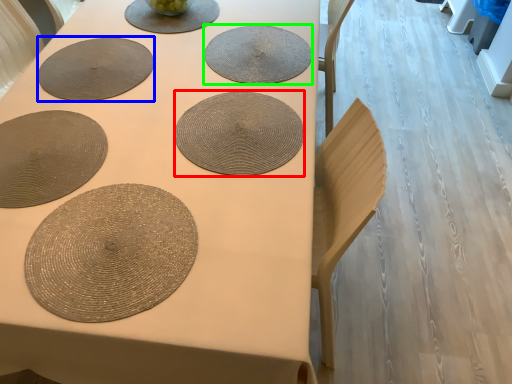
Question: Which object is the closest to the coaster (highlighted by a red box)? Choose among these: paper plate (highlighted by a blue box) or coaster (highlighted by a green box).

Choices:
 (A) paper plate
 (B) coaster

Answer: (B)